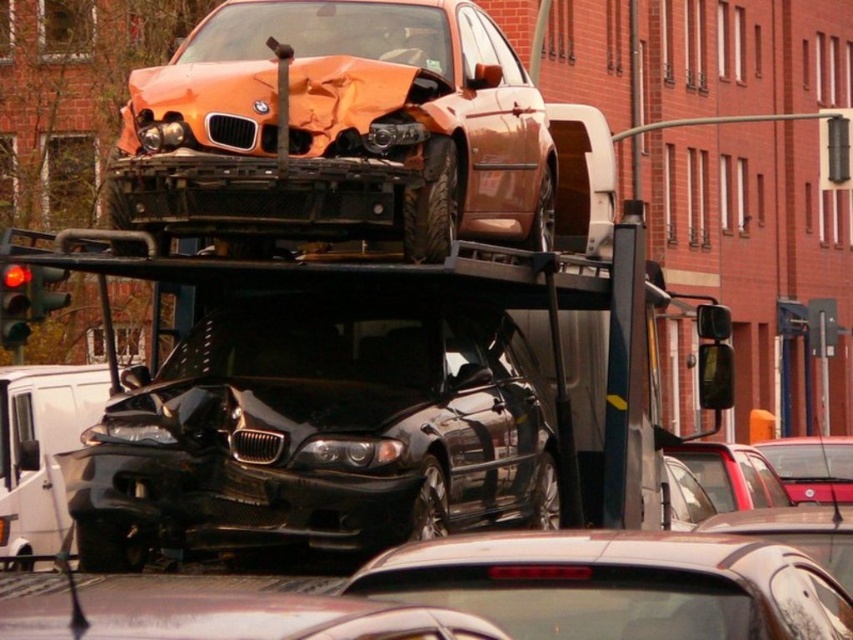
Question: Among these points, which one is farthest from the camera?

Choices:
 (A) click(x=57, y=582)
 (B) click(x=498, y=593)
 (C) click(x=62, y=529)
 (D) click(x=827, y=456)

Answer: (D)

Question: Which object is the closest to the shiny metallic car at center?

Choices:
 (A) shiny brown car at center
 (B) orange matte car at upper center

Answer: (B)

Question: Which is farther from the orange matte car at upper center?

Choices:
 (A) metallic red sedan at center
 (B) metallic red car at center
 (C) shiny black sedan at center
 (D) black glossy sedan at center

Answer: (A)

Question: Is black glossy sedan at center thinner than metallic red sedan at center?

Choices:
 (A) yes
 (B) no

Answer: (A)

Question: Is shiny brown car at center below black glossy sedan at center?

Choices:
 (A) yes
 (B) no

Answer: (B)

Question: Can you confirm if shiny black sedan at center is positioned above metallic red car at center?

Choices:
 (A) yes
 (B) no

Answer: (A)